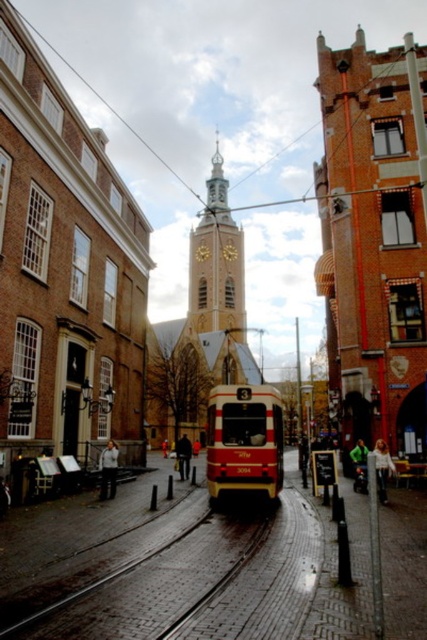
Question: Is gold-plated spire at center above brick paved train track at center?

Choices:
 (A) yes
 (B) no

Answer: (A)

Question: Does gold-plated spire at center come in front of brick paved train track at center?

Choices:
 (A) no
 (B) yes

Answer: (A)

Question: Is gold-plated spire at center positioned at the back of brick paved train track at center?

Choices:
 (A) yes
 (B) no

Answer: (A)

Question: Which point is closer to the camera?

Choices:
 (A) brick paved train track at center
 (B) gold-plated spire at center

Answer: (A)